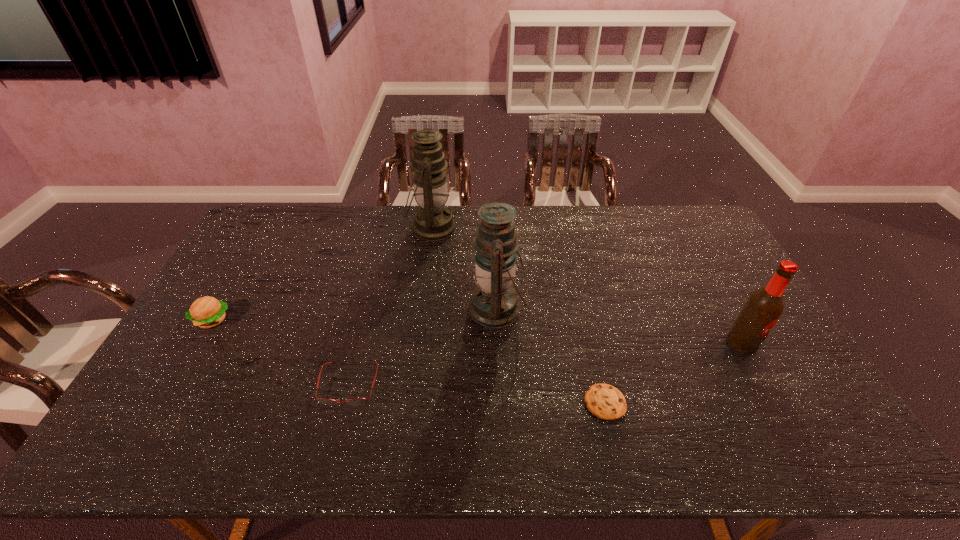
Locate an element on the screen. free spot that satisfies the following two spatial constraints: 1. on the back side of the nearer oil lamp; 2. on the right side of the leftmost object is located at coordinates (219, 308).

Image resolution: width=960 pixels, height=540 pixels. Find the location of `free point that satisfies the following two spatial constraints: 1. on the front side of the third tallest object; 2. on the left side of the leftmost object`. free point that satisfies the following two spatial constraints: 1. on the front side of the third tallest object; 2. on the left side of the leftmost object is located at coordinates (x=199, y=343).